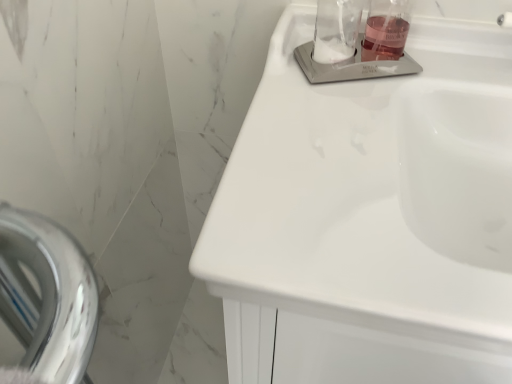
Question: Is translucent glass liquid at upper right situated inside clear glass jar at upper center or outside?

Choices:
 (A) inside
 (B) outside

Answer: (B)

Question: From a real-world perspective, is translucent glass liquid at upper right positioned above or below clear glass jar at upper center?

Choices:
 (A) above
 (B) below

Answer: (B)

Question: Which object is the closest to the white glossy sink at upper right, acting as the 1th sink starting from the front?

Choices:
 (A) translucent glass liquid at upper right
 (B) clear glass jar at upper center
 (C) clear glass soap dispenser at upper right, the first sink in the top-to-bottom sequence

Answer: (C)

Question: Estimate the real-world distances between objects in this image. Which object is closer to the white glossy sink at upper right, the 1th sink when ordered from bottom to top?

Choices:
 (A) translucent glass liquid at upper right
 (B) clear glass soap dispenser at upper right, positioned as the second sink in front-to-back order
 (C) clear glass jar at upper center

Answer: (B)